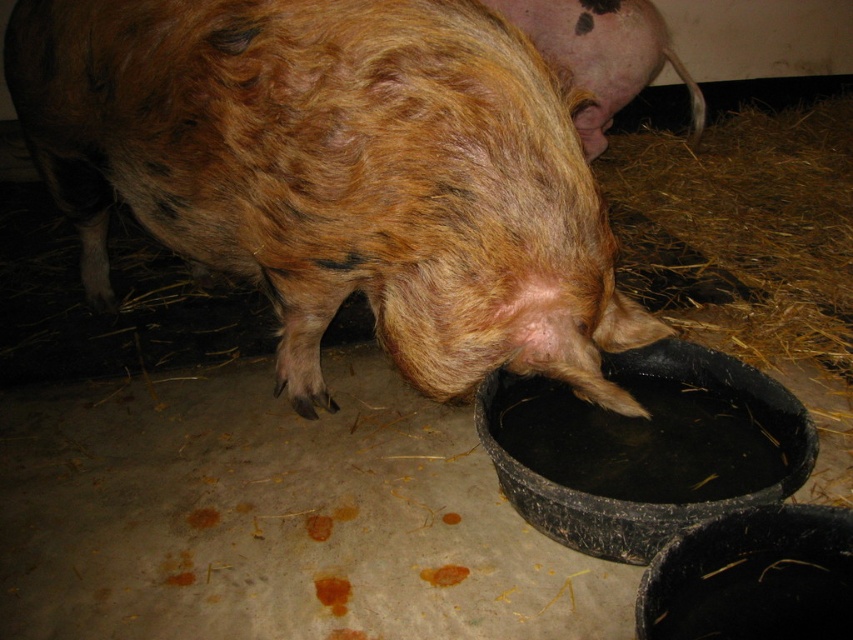
You are a farmer checking the pigs in the barn. You have a 30 inch long measuring tape. Can you determine if the distance between the brown furry pig at center and the pink soft skin at upper right is within the measuring range of your tape?

The distance between the brown furry pig at center and the pink soft skin at upper right is 29.91 inches, which is just under the 30 inch measuring range of your tape. Therefore, the distance is within the tape measure range.

You are a farmer checking the health of the pigs. You notice the brown furry pig at center and the pink soft skin at upper right. Which one is taller?

The brown furry pig at center is taller than the pink soft skin at upper right.

You are a farmer checking the pigs in the barn. You see the brown furry pig at center and the pink soft skin at upper right. Which one is closer to the right side of the barn?

The pink soft skin at upper right is closer to the right side of the barn because it is positioned to the right of the brown furry pig at center.